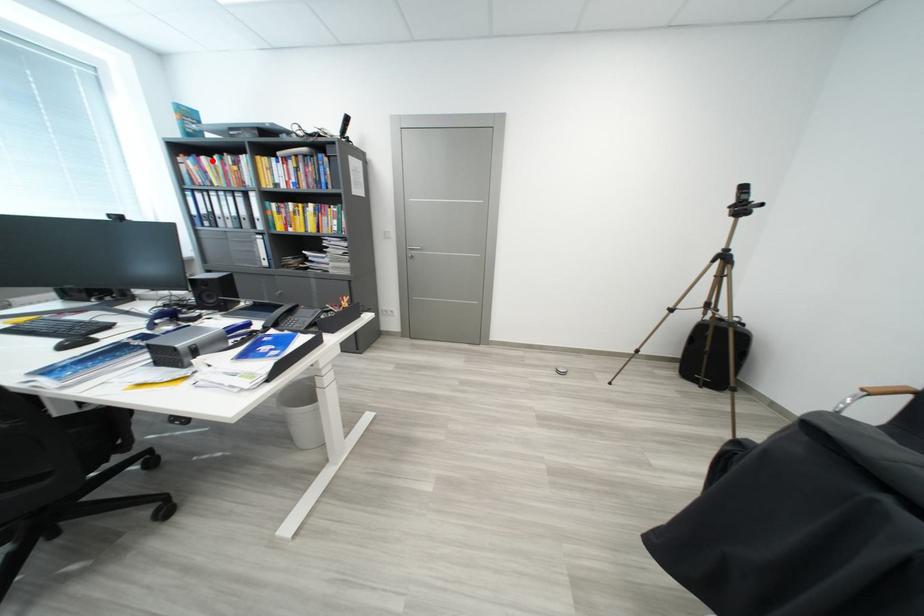
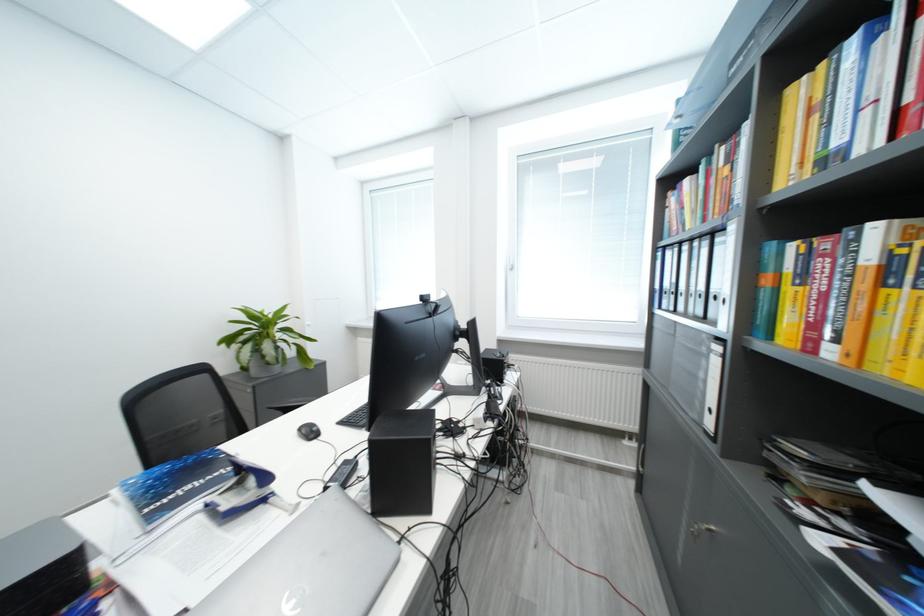
Find the pixel in the second image that matches the highlighted location in the first image.

(696, 184)